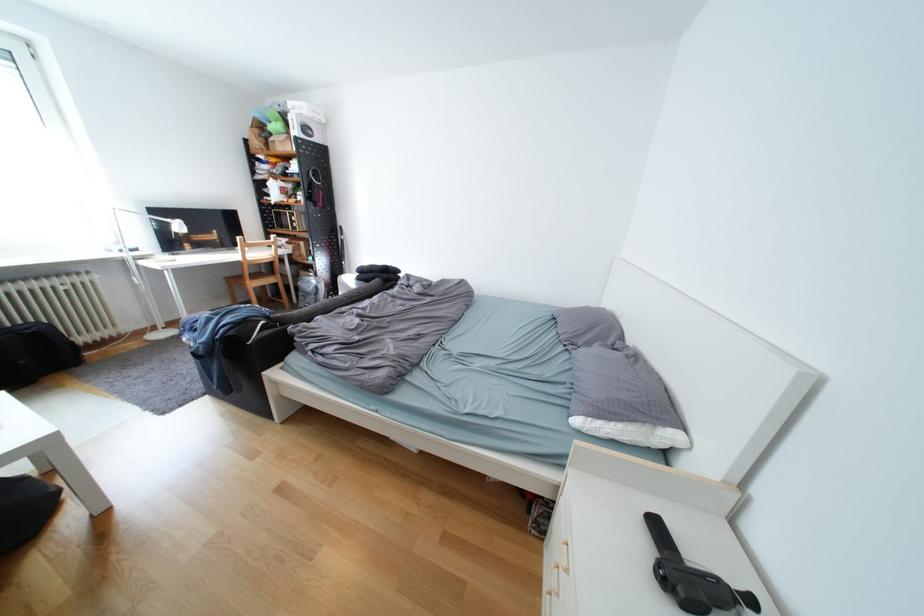
The width and height of the screenshot is (924, 616). I want to click on microwave door handle, so click(x=693, y=578).